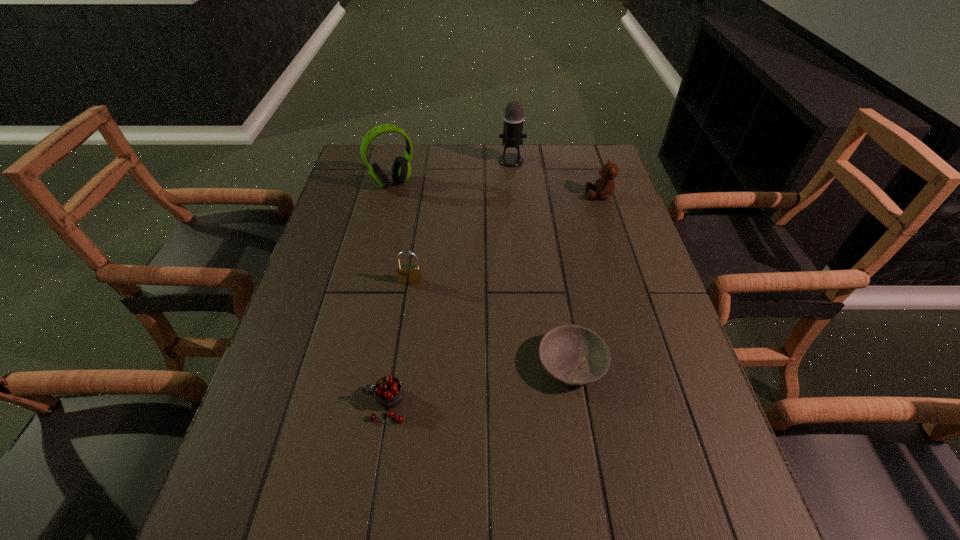
The width and height of the screenshot is (960, 540). In order to click on vacant region between the bowl and the headset in this screenshot , I will do `click(482, 274)`.

This screenshot has height=540, width=960. Identify the location of empty space between the fifth tallest object and the headset. (389, 294).

This screenshot has width=960, height=540. Find the location of `unoccupied position between the microphone and the teddy bear`. unoccupied position between the microphone and the teddy bear is located at coordinates (556, 178).

Locate an element on the screen. empty location between the headset and the farthest object is located at coordinates (452, 172).

Locate an element on the screen. Image resolution: width=960 pixels, height=540 pixels. vacant region between the rightmost object and the headset is located at coordinates tap(496, 190).

Locate an element on the screen. This screenshot has height=540, width=960. object that stands as the fourth closest to the cherry is located at coordinates (604, 186).

Locate which object ranks third in proximity to the rightmost object. Please provide its 2D coordinates. Your answer should be formatted as a tuple, i.e. [(x, y)], where the tuple contains the x and y coordinates of a point satisfying the conditions above.

[(401, 169)]

Where is `blank space that satisfies the following two spatial constraints: 1. on the handle side of the cherry; 2. on the front side of the headset`? blank space that satisfies the following two spatial constraints: 1. on the handle side of the cherry; 2. on the front side of the headset is located at coordinates (421, 184).

Where is `vacant space that satisfies the following two spatial constraints: 1. on the face of the teddy bear; 2. on the front-facing side of the padlock`? The height and width of the screenshot is (540, 960). vacant space that satisfies the following two spatial constraints: 1. on the face of the teddy bear; 2. on the front-facing side of the padlock is located at coordinates (627, 281).

This screenshot has height=540, width=960. I want to click on vacant space that satisfies the following two spatial constraints: 1. on the handle side of the second shortest object; 2. on the back side of the farthest object, so click(425, 161).